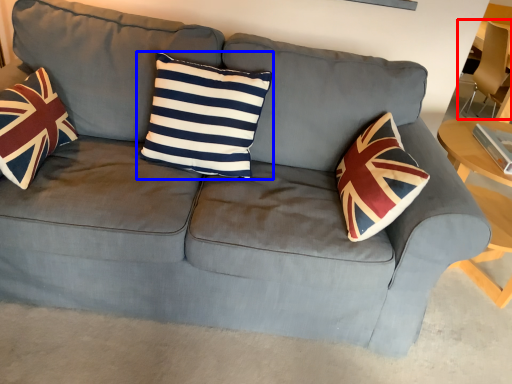
Question: Which point is further to the camera, armchair (highlighted by a red box) or pillow (highlighted by a blue box)?

Choices:
 (A) armchair
 (B) pillow

Answer: (A)